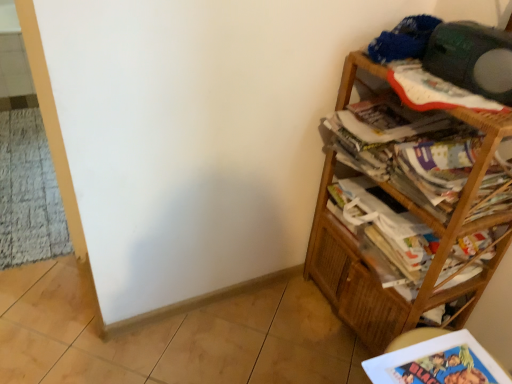
Find the location of a particular element. The height and width of the screenshot is (384, 512). vacant area on top of white glossy book at lower right (from a real-world perspective) is located at coordinates (451, 363).